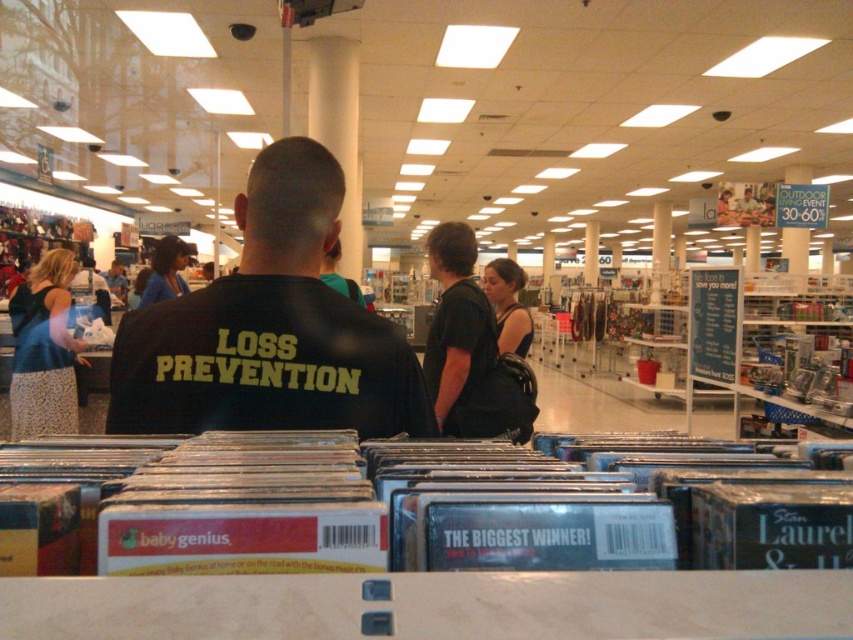
You are standing at the point marked as point [410,369] in the store. You need to walk to the security desk located at the entrance. The security desk is 10 feet away from your current position. Can you reach the security desk without moving more than 10 feet?

The distance between point [410,369] and the viewer is 4.54 feet. Since the security desk is 10 feet away from your current position, you can reach it without exceeding the 10 feet limit.

From the picture: You are a customer in the store and you see both the black fabric shirt at center and the black leather handbag at center. Which item is closer to the left side of the store?

The black fabric shirt at center is to the left of the black leather handbag at center, so it is closer to the left side of the store.